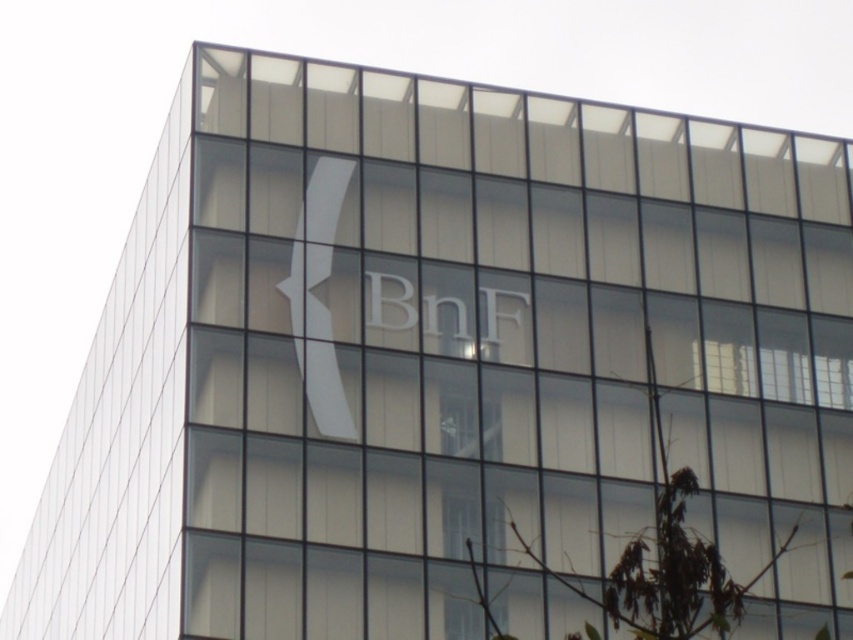
Question: Which of the following is the farthest from the observer?

Choices:
 (A) transparent glass window at center
 (B) white glass logo at center

Answer: (A)

Question: Does white glass logo at center have a greater width compared to transparent glass window at center?

Choices:
 (A) yes
 (B) no

Answer: (A)

Question: Considering the relative positions of white glass logo at center and transparent glass window at center in the image provided, where is white glass logo at center located with respect to transparent glass window at center?

Choices:
 (A) left
 (B) right

Answer: (A)

Question: Where is white glass logo at center located in relation to transparent glass window at center in the image?

Choices:
 (A) left
 (B) right

Answer: (A)

Question: Which object appears farthest from the camera in this image?

Choices:
 (A) transparent glass window at center
 (B) white glass logo at center

Answer: (A)